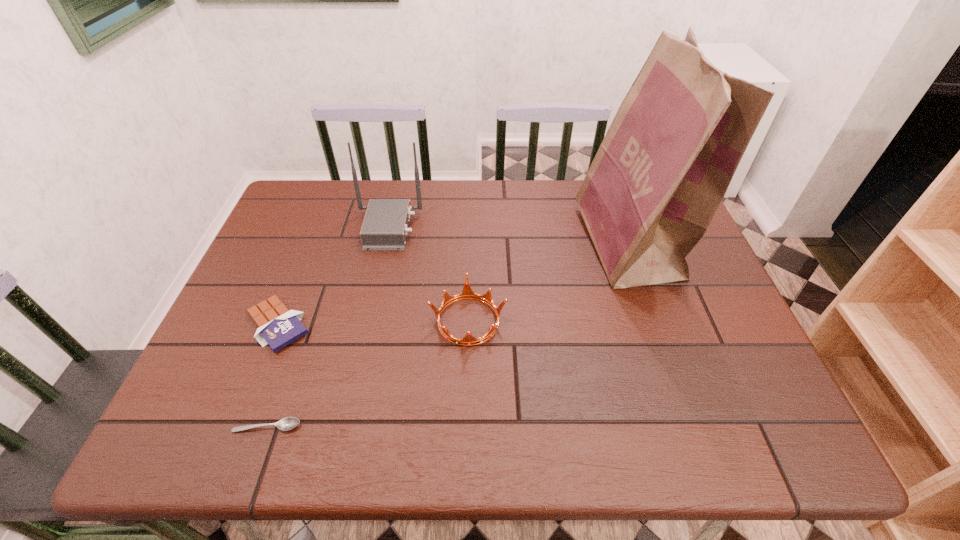
Identify the location of vacant region located 0.270m on the front-facing side of the tallest object. The image size is (960, 540). (488, 243).

Image resolution: width=960 pixels, height=540 pixels. I want to click on vacant area situated 0.090m on the back of the router to connect cables, so click(451, 228).

Locate an element on the screen. vacant region located 0.160m on the front of the third tallest object is located at coordinates (466, 420).

At what (x,y) coordinates should I click in order to perform the action: click on vacant space located 0.170m on the right of the chocolate bar. Please return your answer as a coordinate pair (x, y). This screenshot has width=960, height=540. Looking at the image, I should click on (384, 325).

Where is `free space located 0.060m on the left of the shortest object`? The image size is (960, 540). free space located 0.060m on the left of the shortest object is located at coordinates (204, 426).

The height and width of the screenshot is (540, 960). I want to click on grocery bag that is at the far edge, so click(662, 170).

The image size is (960, 540). Identify the location of router present at the far edge. (385, 226).

Identify the location of object that is at the near edge. (288, 423).

Where is `chocolate bar at the left edge`? chocolate bar at the left edge is located at coordinates (277, 326).

This screenshot has width=960, height=540. What are the coordinates of `soupspoon situated at the left edge` in the screenshot? It's located at (288, 423).